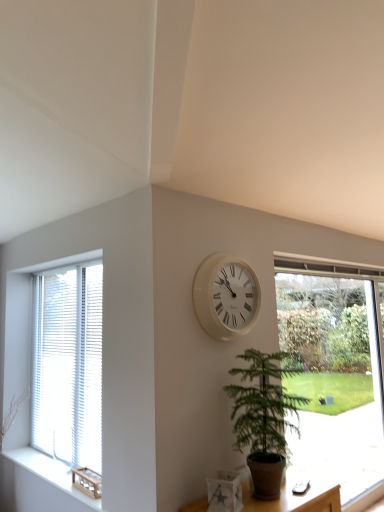
Question: Is white plastic clock at center further to camera compared to white wood blinds at left, acting as the first window starting from the left?

Choices:
 (A) no
 (B) yes

Answer: (A)

Question: Is white plastic clock at center closer to camera compared to white wood blinds at left, acting as the first window starting from the left?

Choices:
 (A) no
 (B) yes

Answer: (B)

Question: Is white plastic clock at center surrounding white wood blinds at left, which is counted as the 2th window, starting from the right?

Choices:
 (A) yes
 (B) no

Answer: (B)

Question: Is white plastic clock at center to the left of white wood blinds at left, acting as the first window starting from the left, from the viewer's perspective?

Choices:
 (A) no
 (B) yes

Answer: (A)

Question: From a real-world perspective, is white plastic clock at center on white wood blinds at left, which is counted as the 2th window, starting from the right?

Choices:
 (A) yes
 (B) no

Answer: (A)

Question: From the image's perspective, is white plastic clock at center below white wood blinds at left, which is counted as the 2th window, starting from the right?

Choices:
 (A) no
 (B) yes

Answer: (A)

Question: Is white matte vase at lower center aimed at transparent glass window at right, arranged as the first window when viewed from the right?

Choices:
 (A) yes
 (B) no

Answer: (B)

Question: From the image's perspective, does white matte vase at lower center appear lower than transparent glass window at right, arranged as the first window when viewed from the right?

Choices:
 (A) yes
 (B) no

Answer: (A)

Question: From a real-world perspective, is white matte vase at lower center under transparent glass window at right, arranged as the second window when viewed from the left?

Choices:
 (A) no
 (B) yes

Answer: (B)

Question: Does white matte vase at lower center have a larger size compared to transparent glass window at right, arranged as the second window when viewed from the left?

Choices:
 (A) no
 (B) yes

Answer: (A)

Question: Is white matte vase at lower center outside transparent glass window at right, arranged as the first window when viewed from the right?

Choices:
 (A) yes
 (B) no

Answer: (A)

Question: Is white matte vase at lower center positioned with its back to transparent glass window at right, arranged as the first window when viewed from the right?

Choices:
 (A) yes
 (B) no

Answer: (B)

Question: Can you confirm if green leafy plant at center is smaller than white wood blinds at left, which is counted as the 2th window, starting from the right?

Choices:
 (A) no
 (B) yes

Answer: (A)